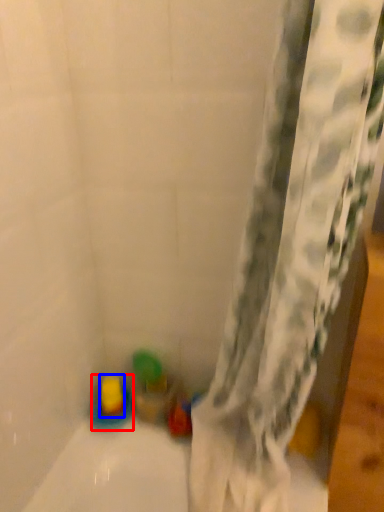
Question: Which object is further to the camera taking this photo, toy (highlighted by a red box) or toy (highlighted by a blue box)?

Choices:
 (A) toy
 (B) toy

Answer: (B)